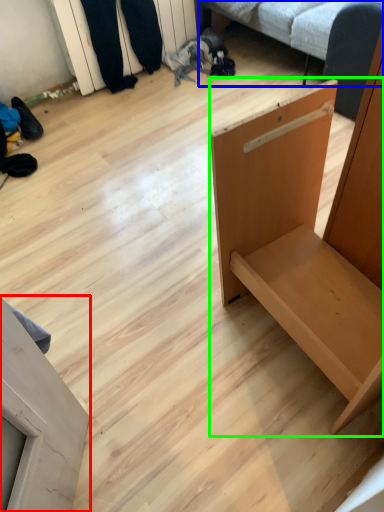
Question: Considering the real-world distances, which object is closest to furniture (highlighted by a red box)? studio couch (highlighted by a blue box) or furniture (highlighted by a green box).

Choices:
 (A) studio couch
 (B) furniture

Answer: (B)